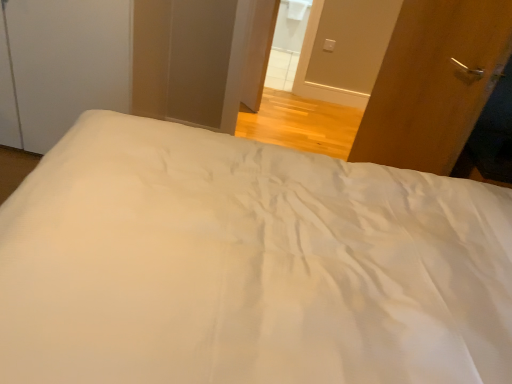
Question: Is wooden door at right facing away from white glossy door at upper center, which ranks as the second screen door in left-to-right order?

Choices:
 (A) no
 (B) yes

Answer: (A)

Question: Would you consider wooden door at right to be distant from white glossy door at upper center, which appears as the first screen door when viewed from the right?

Choices:
 (A) no
 (B) yes

Answer: (B)

Question: From a real-world perspective, is wooden door at right positioned under white glossy door at upper center, which ranks as the second screen door in left-to-right order, based on gravity?

Choices:
 (A) no
 (B) yes

Answer: (B)

Question: Is wooden door at right closer to the viewer compared to white glossy door at upper center, which ranks as the second screen door in left-to-right order?

Choices:
 (A) yes
 (B) no

Answer: (A)

Question: Can you confirm if wooden door at right is thinner than white glossy door at upper center, which ranks as the second screen door in left-to-right order?

Choices:
 (A) yes
 (B) no

Answer: (A)

Question: Considering the positions of point (398, 34) and point (342, 71), is point (398, 34) closer or farther from the camera than point (342, 71)?

Choices:
 (A) farther
 (B) closer

Answer: (B)

Question: Is wooden door at right wider or thinner than white glossy door at upper center, which appears as the first screen door when viewed from the right?

Choices:
 (A) wide
 (B) thin

Answer: (B)

Question: From a real-world perspective, is wooden door at right above or below white glossy door at upper center, which ranks as the second screen door in left-to-right order?

Choices:
 (A) below
 (B) above

Answer: (A)

Question: Considering the positions of wooden door at right and white glossy door at upper center, which appears as the first screen door when viewed from the right, in the image, is wooden door at right taller or shorter than white glossy door at upper center, which appears as the first screen door when viewed from the right,?

Choices:
 (A) short
 (B) tall

Answer: (B)

Question: In terms of size, does white matte screen door at upper left, the 1th screen door viewed from the left, appear bigger or smaller than white glossy door at upper center, which appears as the first screen door when viewed from the right?

Choices:
 (A) small
 (B) big

Answer: (B)

Question: Is white matte screen door at upper left, the 1th screen door viewed from the left, wider or thinner than white glossy door at upper center, which appears as the first screen door when viewed from the right?

Choices:
 (A) thin
 (B) wide

Answer: (B)

Question: Is white matte screen door at upper left, the 1th screen door viewed from the left, situated inside white glossy door at upper center, which appears as the first screen door when viewed from the right, or outside?

Choices:
 (A) inside
 (B) outside

Answer: (B)

Question: From the image's perspective, is white matte screen door at upper left, the 1th screen door viewed from the left, above or below white glossy door at upper center, which appears as the first screen door when viewed from the right?

Choices:
 (A) below
 (B) above

Answer: (A)

Question: From a real-world perspective, is white glossy door at upper center, which appears as the first screen door when viewed from the right, physically located above or below wooden door at right?

Choices:
 (A) below
 (B) above

Answer: (B)

Question: Considering their positions, is white glossy door at upper center, which ranks as the second screen door in left-to-right order, located in front of or behind wooden door at right?

Choices:
 (A) front
 (B) behind

Answer: (B)